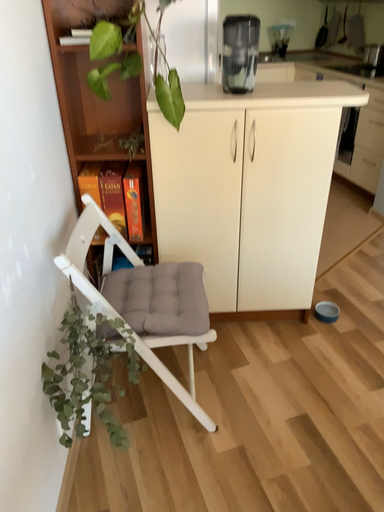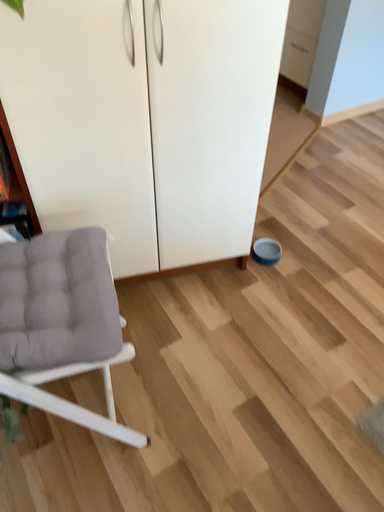
Question: How did the camera likely rotate when shooting the video?

Choices:
 (A) rotated downward
 (B) rotated upward

Answer: (A)